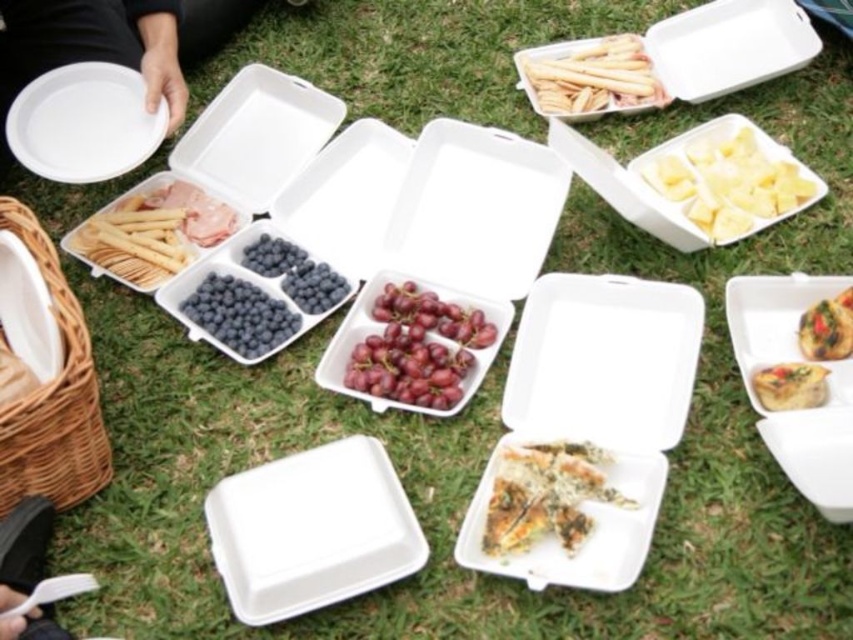
In the scene shown: Does yellow matte pineapple at upper right lie behind white plastic spoon at lower left?

That is True.

Is yellow matte pineapple at upper right closer to camera compared to white plastic spoon at lower left?

No.

Between point (671, 160) and point (22, 560), which one is positioned in front?

Point (22, 560)

Where is `yellow matte pineapple at upper right`? yellow matte pineapple at upper right is located at coordinates (727, 179).

Based on the photo, how much distance is there between woven brown picnic basket at lower left and matte white tray at center-left?

woven brown picnic basket at lower left and matte white tray at center-left are 15.49 inches apart from each other.

Is point (39, 481) farther from camera compared to point (131, 212)?

No, (39, 481) is in front of (131, 212).

This screenshot has height=640, width=853. Identify the location of woven brown picnic basket at lower left. [53, 397].

Between woven brown picnic basket at lower left and matte pink meat at upper left, which one is positioned lower?

woven brown picnic basket at lower left is lower down.

The width and height of the screenshot is (853, 640). Describe the element at coordinates (53, 397) in the screenshot. I see `woven brown picnic basket at lower left` at that location.

Where is `woven brown picnic basket at lower left`? This screenshot has height=640, width=853. woven brown picnic basket at lower left is located at coordinates (53, 397).

In order to click on woven brown picnic basket at lower left in this screenshot , I will do `click(53, 397)`.